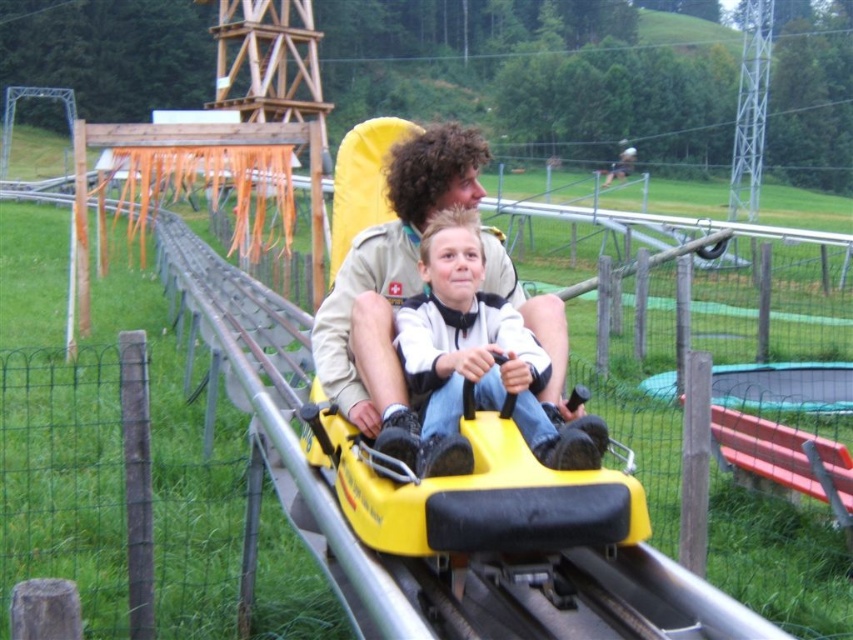
You are a safety inspector checking the roller coaster car. You notice two items at the center of the car. One is the khaki uniform at center and the other is the matte yellow helmet at center. Which item takes up more space in the scene?

The khaki uniform at center is larger in size than the matte yellow helmet at center, so the khaki uniform at center takes up more space in the scene.

You are a safety inspector checking the roller coaster car. You notice two items at the center of the car. What is the position of the khaki uniform at center relative to the matte yellow helmet at center?

The khaki uniform at center is above the matte yellow helmet at center.

You are a safety inspector checking the distance between the khaki uniform at center and the matte yellow helmet at center. According to safety regulations, the minimum required distance between any two passengers is 10 inches. Is the current distance compliant with the safety regulations?

The khaki uniform at center is 8.06 inches from the matte yellow helmet at center. Since the minimum required distance is 10 inches, the current distance of 8.06 inches is below the required safety standard. Therefore, it does not comply with the safety regulations.